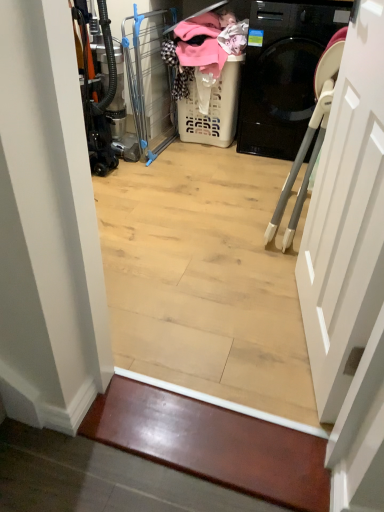
I want to click on vacant space situated above shiny wood stair at lower center (from a real-world perspective), so click(213, 431).